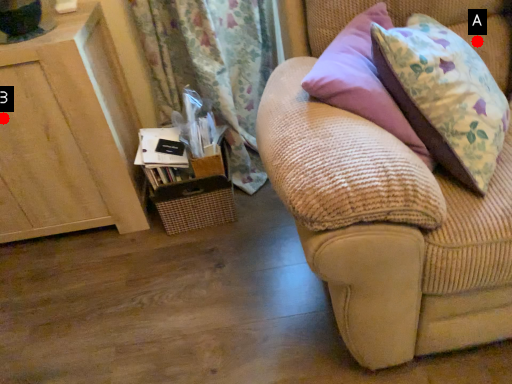
Question: Two points are circled on the image, labeled by A and B beside each circle. Which point is farther from the camera taking this photo?

Choices:
 (A) A is further
 (B) B is further

Answer: (B)